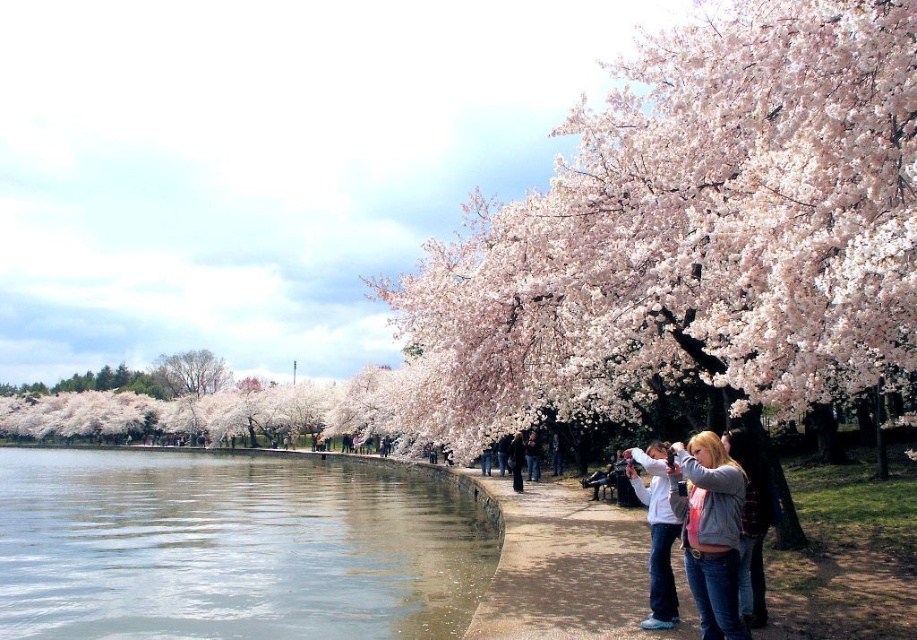
Question: Is clear water at lower left to the left of denim jacket at lower center from the viewer's perspective?

Choices:
 (A) yes
 (B) no

Answer: (A)

Question: Can you confirm if denim jacket at lower center is bigger than smooth bark tree at left?

Choices:
 (A) yes
 (B) no

Answer: (B)

Question: Which is farther from the smooth bark tree at left?

Choices:
 (A) clear water at lower left
 (B) denim jacket at lower center

Answer: (B)

Question: Which object is farther from the camera taking this photo?

Choices:
 (A) denim jacket at lower center
 (B) clear water at lower left
 (C) smooth bark tree at left

Answer: (C)

Question: Does clear water at lower left appear under denim jacket at lower center?

Choices:
 (A) no
 (B) yes

Answer: (B)

Question: Which object is closer to the camera taking this photo?

Choices:
 (A) smooth bark tree at left
 (B) denim jacket at lower center
 (C) clear water at lower left

Answer: (B)